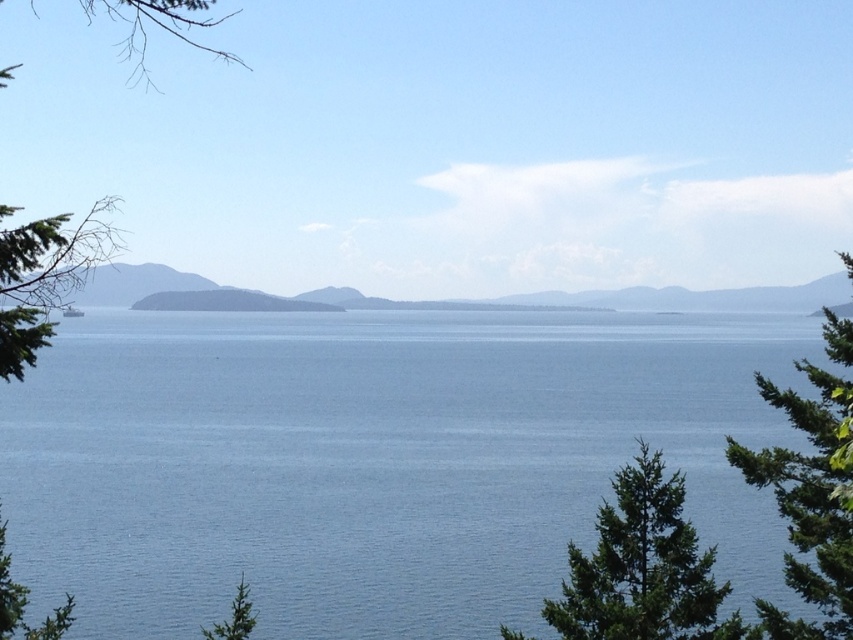
Question: Which of the following is the farthest from the observer?

Choices:
 (A) green textured tree at lower right
 (B) blue water at center

Answer: (B)

Question: Is blue water at center above green textured tree at lower right?

Choices:
 (A) yes
 (B) no

Answer: (A)

Question: Does blue water at center appear over green leafy tree at left?

Choices:
 (A) no
 (B) yes

Answer: (A)

Question: Which point is farther to the camera?

Choices:
 (A) (115, 200)
 (B) (840, 259)
 (C) (660, 557)

Answer: (A)

Question: Which point appears farthest from the camera in this image?

Choices:
 (A) (605, 532)
 (B) (235, 60)
 (C) (541, 336)
 (D) (822, 532)

Answer: (B)

Question: Is blue water at center smaller than green leafy tree at left?

Choices:
 (A) no
 (B) yes

Answer: (B)